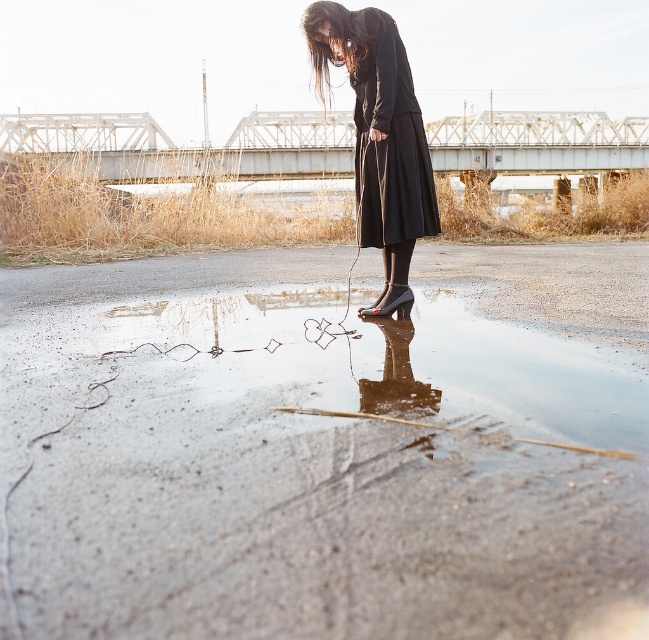
You are a photographer trying to capture the matte black dress at center and the black matte dress at center in a single shot. Given that your camera has a maximum focus range of 5 centimeters, can you ensure both dresses are in focus?

The distance between the matte black dress at center and the black matte dress at center is 4.85 centimeters, which is within the camera focus range of 5 centimeters. Therefore, both dresses can be captured in focus.

Based on the scene description provided, what are the coordinates of the glossy concrete puddle at center?

The glossy concrete puddle at center is located at coordinates point (312, 474).

You are a delivery robot that is 2 feet wide. You need to move from the glossy concrete puddle at center to the black matte dress at center. Can you fit through the space between them?

The distance between the glossy concrete puddle at center and the black matte dress at center is 4.93 feet. Since the robot is 2 feet wide, it can easily navigate the space between them as the distance is more than sufficient for its width.